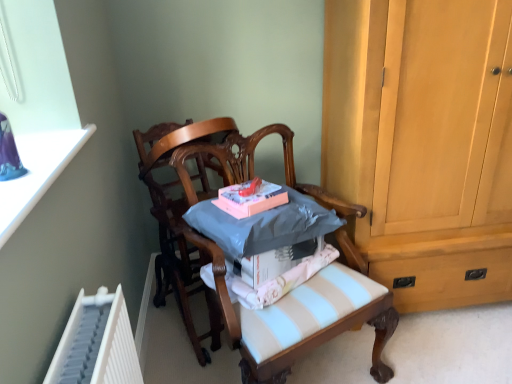
At what (x,y) coordinates should I click in order to perform the action: click on free space above pink matte book at center (from a real-world perspective). Please return your answer as a coordinate pair (x, y). This screenshot has height=384, width=512. Looking at the image, I should click on (254, 188).